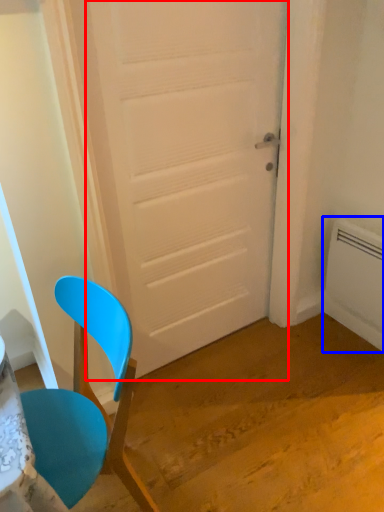
Question: Which of the following is the closest to the observer, door (highlighted by a red box) or radiator (highlighted by a blue box)?

Choices:
 (A) door
 (B) radiator

Answer: (A)